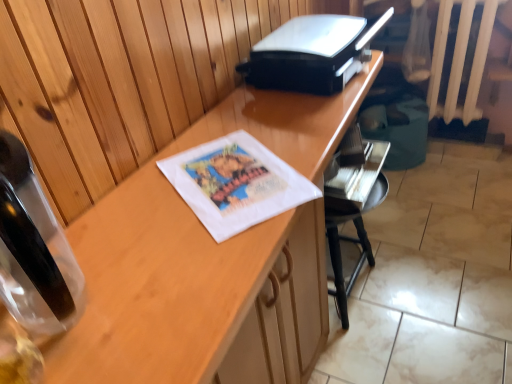
At what (x,y) coordinates should I click in order to perform the action: click on free space on the front side of black plastic printer at upper center. Please return your answer as a coordinate pair (x, y). The image size is (512, 384). Looking at the image, I should click on (281, 133).